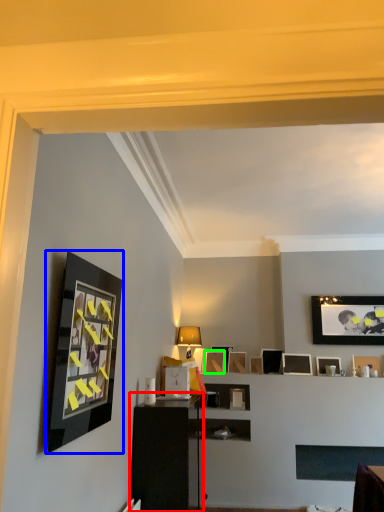
Question: Estimate the real-world distances between objects in this image. Which object is closer to dresser (highlighted by a red box), picture frame (highlighted by a blue box) or picture frame (highlighted by a green box)?

Choices:
 (A) picture frame
 (B) picture frame

Answer: (A)